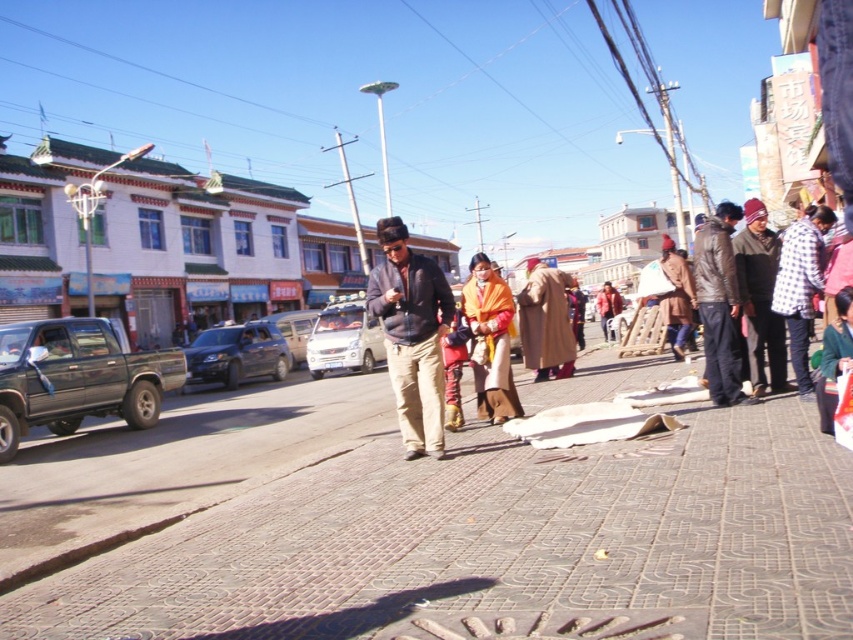
How distant is brown textured pavement at center from shiny black suv at center-left?

brown textured pavement at center is 37.90 feet from shiny black suv at center-left.

What are the coordinates of `brown textured pavement at center` in the screenshot? It's located at (422, 525).

Does point (163, 513) lie behind point (221, 355)?

No, it is in front of (221, 355).

What are the coordinates of `brown textured pavement at center` in the screenshot? It's located at (422, 525).

Can you confirm if brown textured pavement at center is positioned to the right of dark gray jacket at center?

Correct, you'll find brown textured pavement at center to the right of dark gray jacket at center.

Image resolution: width=853 pixels, height=640 pixels. Find the location of `brown textured pavement at center`. brown textured pavement at center is located at coordinates (422, 525).

Image resolution: width=853 pixels, height=640 pixels. Find the location of `brown textured pavement at center`. brown textured pavement at center is located at coordinates (422, 525).

Can you confirm if dark gray jacket at center is thinner than dark brown leather jacket at right?

Indeed, dark gray jacket at center has a lesser width compared to dark brown leather jacket at right.

Is point (405, 273) more distant than point (728, 205)?

No, (405, 273) is closer to viewer.

The width and height of the screenshot is (853, 640). I want to click on dark gray jacket at center, so click(410, 336).